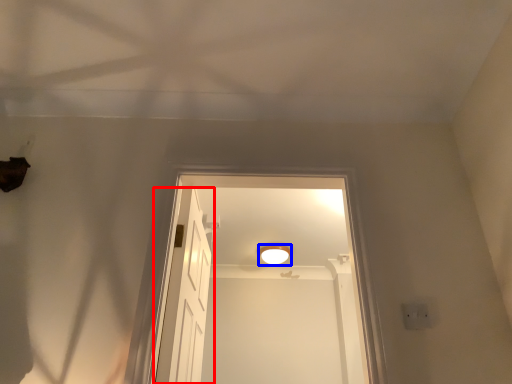
Question: Which of the following is the closest to the observer, door (highlighted by a red box) or light fixture (highlighted by a blue box)?

Choices:
 (A) door
 (B) light fixture

Answer: (A)